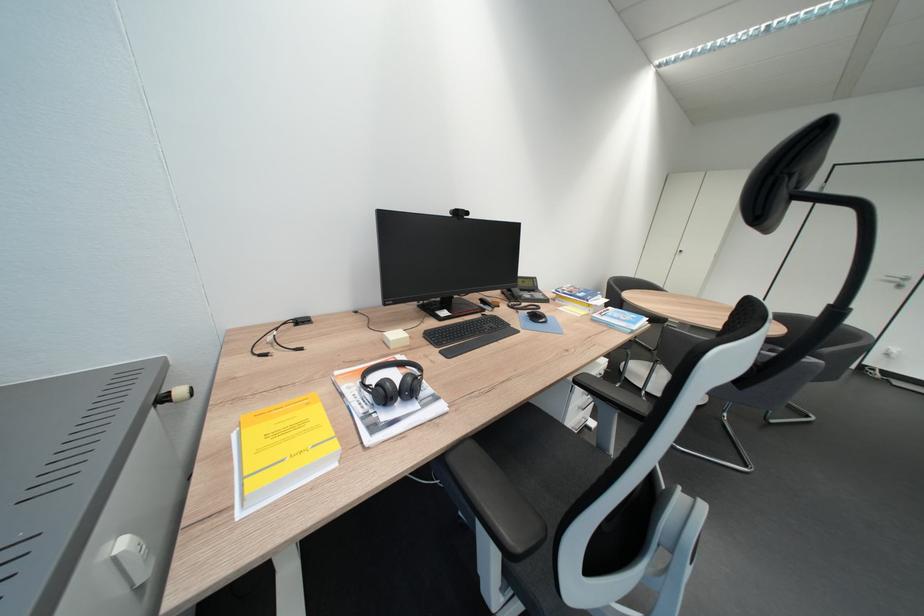
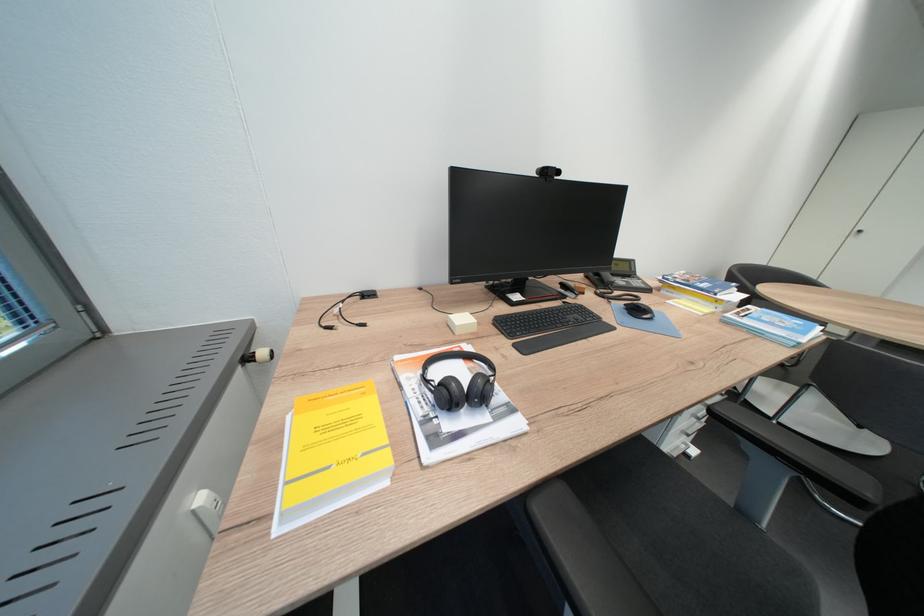
Question: Based on the continuous images, in which direction is the camera rotating? Reply with the corresponding letter.

Choices:
 (A) Left
 (B) Right
 (C) Up
 (D) Down

Answer: (A)